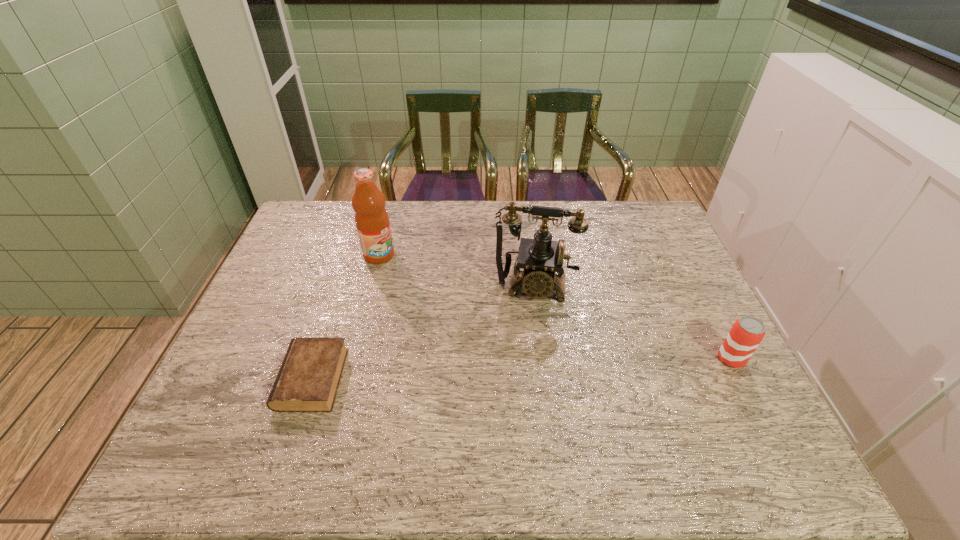
At what (x,y) coordinates should I click in order to perform the action: click on free space on the desktop that is between the diary and the beer can and is positioned on the front label of the fruit juice. Please return your answer as a coordinate pair (x, y). Looking at the image, I should click on (530, 368).

The image size is (960, 540). What are the coordinates of `free space on the desktop that is between the diary and the rightmost object and is positioned on the rotary dial of the second farthest object` in the screenshot? It's located at (526, 369).